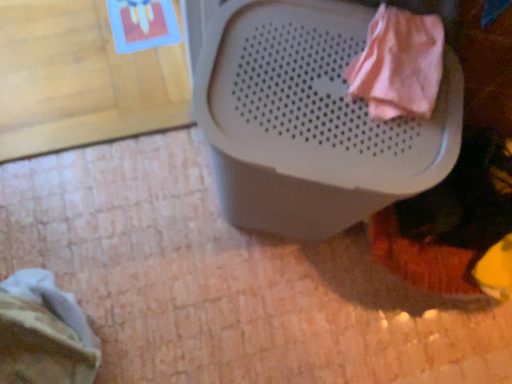
This screenshot has height=384, width=512. I want to click on blank space to the left of white plastic waste container at upper center, so click(150, 201).